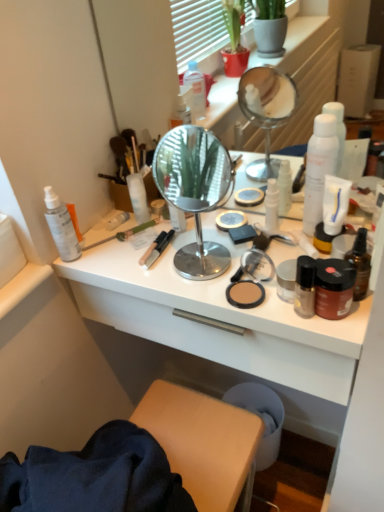
What is the approximate width of white matte spray can at right, the second bottle from the front?

white matte spray can at right, the second bottle from the front, is 5.17 centimeters in width.

The height and width of the screenshot is (512, 384). Describe the element at coordinates (61, 226) in the screenshot. I see `translucent plastic spray bottle at left, which is the eighth toiletry in right-to-left order` at that location.

You are a GUI agent. You are given a task and a screenshot of the screen. Output one action in this format:
    pyautogui.click(x=<x>, y=<y>)
    Task: Click on the brown matte jar at right, which is the seventh toiletry from left to right
    This screenshot has width=384, height=512.
    Given the screenshot: What is the action you would take?
    pyautogui.click(x=334, y=288)

The image size is (384, 512). Describe the element at coordinates (257, 348) in the screenshot. I see `white glossy desk at center` at that location.

Where is `white glossy bottle at center, the 5th toiletry viewed from the left`? Image resolution: width=384 pixels, height=512 pixels. white glossy bottle at center, the 5th toiletry viewed from the left is located at coordinates (272, 205).

Looking at this image, from a real-world perspective, is white glossy bottle at center, which is the 4th toiletry in right-to-left order, on translucent plastic spray bottle at left, which is the eighth toiletry in right-to-left order?

Incorrect, from a real-world perspective, white glossy bottle at center, which is the 4th toiletry in right-to-left order, is lower than translucent plastic spray bottle at left, which is the eighth toiletry in right-to-left order.

Is white glossy bottle at center, which is the 4th toiletry in right-to-left order, to the right of translucent plastic spray bottle at left, the 1th toiletry when ordered from left to right, from the viewer's perspective?

Yes, white glossy bottle at center, which is the 4th toiletry in right-to-left order, is to the right of translucent plastic spray bottle at left, the 1th toiletry when ordered from left to right.

Is translucent plastic spray bottle at left, the 1th toiletry when ordered from left to right, inside white glossy bottle at center, the 5th toiletry viewed from the left?

No, white glossy bottle at center, the 5th toiletry viewed from the left, does not contain translucent plastic spray bottle at left, the 1th toiletry when ordered from left to right.

Based on their sizes in the image, would you say white glossy bottle at center, which is the 4th toiletry in right-to-left order, is bigger or smaller than translucent plastic spray bottle at left, the 1th toiletry when ordered from left to right?

Considering their sizes, white glossy bottle at center, which is the 4th toiletry in right-to-left order, takes up less space than translucent plastic spray bottle at left, the 1th toiletry when ordered from left to right.

Can you tell me how much brown glass bottle at right, marked as the 1th bottle in a front-to-back arrangement, and matte gold jar at center right, which ranks as the eighth toiletry in left-to-right order, differ in facing direction?

0.00286 degrees.

Could you tell me if brown glass bottle at right, which is counted as the second bottle, starting from the back, is facing matte gold jar at center right, the 1th toiletry positioned from the right?

No, brown glass bottle at right, which is counted as the second bottle, starting from the back, is not oriented towards matte gold jar at center right, the 1th toiletry positioned from the right.

Considering the relative sizes of brown glass bottle at right, which is counted as the second bottle, starting from the back, and matte gold jar at center right, which ranks as the eighth toiletry in left-to-right order, in the image provided, is brown glass bottle at right, which is counted as the second bottle, starting from the back, shorter than matte gold jar at center right, which ranks as the eighth toiletry in left-to-right order,?

In fact, brown glass bottle at right, which is counted as the second bottle, starting from the back, may be taller than matte gold jar at center right, which ranks as the eighth toiletry in left-to-right order.

Does point (363, 282) appear closer or farther from the camera than point (320, 228)?

Point (363, 282) is closer to the camera than point (320, 228).

Is point (318, 222) behind point (364, 241)?

Yes, point (318, 222) is behind point (364, 241).

From a real-world perspective, which is physically below, white matte spray can at right, which is the first bottle from back to front, or brown glass bottle at right, positioned as the 2th bottle in top-to-bottom order?

In real-world perspective, brown glass bottle at right, positioned as the 2th bottle in top-to-bottom order, is lower.

In the scene shown: Considering the positions of objects white matte spray can at right, the second bottle from the front, and brown glass bottle at right, positioned as the 2th bottle in top-to-bottom order, in the image provided, who is more to the right, white matte spray can at right, the second bottle from the front, or brown glass bottle at right, positioned as the 2th bottle in top-to-bottom order,?

brown glass bottle at right, positioned as the 2th bottle in top-to-bottom order, is more to the right.

How different are the orientations of white matte spray can at right, which is the first bottle from back to front, and brown glass bottle at right, marked as the 1th bottle in a front-to-back arrangement, in degrees?

They differ by 0.00343 degrees in their facing directions.

Is white matte spray can at right, the second bottle from the front, oriented away from brown matte jar at right, the second toiletry viewed from the right?

No, white matte spray can at right, the second bottle from the front, is not facing the opposite direction of brown matte jar at right, the second toiletry viewed from the right.

Considering the sizes of white matte spray can at right, which is the 2th bottle from bottom to top, and brown matte jar at right, which is the seventh toiletry from left to right, in the image, is white matte spray can at right, which is the 2th bottle from bottom to top, taller or shorter than brown matte jar at right, which is the seventh toiletry from left to right,?

In the image, white matte spray can at right, which is the 2th bottle from bottom to top, appears to be taller than brown matte jar at right, which is the seventh toiletry from left to right.

From the image's perspective, which is below, white matte spray can at right, which is the first bottle from back to front, or brown matte jar at right, which is the seventh toiletry from left to right?

brown matte jar at right, which is the seventh toiletry from left to right.

In the image, is white matte spray can at right, the second bottle from the front, positioned in front of or behind brown matte jar at right, which is the seventh toiletry from left to right?

white matte spray can at right, the second bottle from the front, is behind brown matte jar at right, which is the seventh toiletry from left to right.

Considering the sizes of objects brown matte jar at right, which is the seventh toiletry from left to right, and satin black nail polish at right, which appears as the sixth toiletry when viewed from the left, in the image provided, who is smaller, brown matte jar at right, which is the seventh toiletry from left to right, or satin black nail polish at right, which appears as the sixth toiletry when viewed from the left,?

Smaller between the two is satin black nail polish at right, which appears as the sixth toiletry when viewed from the left.

Which object is closer to the camera taking this photo, brown matte jar at right, which is the seventh toiletry from left to right, or satin black nail polish at right, the third toiletry when ordered from right to left?

Positioned in front is satin black nail polish at right, the third toiletry when ordered from right to left.

Looking at the image, does white glossy desk at center seem bigger or smaller compared to matte gold jar at center right, the 1th toiletry positioned from the right?

In the image, white glossy desk at center appears to be larger than matte gold jar at center right, the 1th toiletry positioned from the right.

Is white glossy desk at center turned away from matte gold jar at center right, the 1th toiletry positioned from the right?

No.

Which is more to the right, white glossy desk at center or matte gold jar at center right, the 1th toiletry positioned from the right?

Positioned to the right is matte gold jar at center right, the 1th toiletry positioned from the right.

Who is shorter, white glossy desk at center or matte gold jar at center right, the 1th toiletry positioned from the right?

matte gold jar at center right, the 1th toiletry positioned from the right.

Considering the relative sizes of white matte bottle at center, the 5th toiletry viewed from the right, and matte gold jar at center right, which ranks as the eighth toiletry in left-to-right order, in the image provided, is white matte bottle at center, the 5th toiletry viewed from the right, thinner than matte gold jar at center right, which ranks as the eighth toiletry in left-to-right order,?

Yes, white matte bottle at center, the 5th toiletry viewed from the right, is thinner than matte gold jar at center right, which ranks as the eighth toiletry in left-to-right order.

Could you tell me if white matte bottle at center, the 5th toiletry viewed from the right, is turned towards matte gold jar at center right, which ranks as the eighth toiletry in left-to-right order?

No, white matte bottle at center, the 5th toiletry viewed from the right, is not oriented towards matte gold jar at center right, which ranks as the eighth toiletry in left-to-right order.

Locate an element on the screen. Image resolution: width=384 pixels, height=512 pixels. the 5th toiletry above the matte gold jar at center right, the 1th toiletry positioned from the right (from the image's perspective) is located at coordinates (138, 197).

Is matte gold jar at center right, which ranks as the eighth toiletry in left-to-right order, surrounded by white matte bottle at center, the 5th toiletry viewed from the right?

No, matte gold jar at center right, which ranks as the eighth toiletry in left-to-right order, is located outside of white matte bottle at center, the 5th toiletry viewed from the right.

Locate an element on the screen. The image size is (384, 512). toiletry that is the 4th one when counting leftward from the white glossy bottle at center, the 5th toiletry viewed from the left is located at coordinates (61, 226).

Locate an element on the screen. The image size is (384, 512). the 6th toiletry directly beneath the brown glass bottle at right, which ranks as the first bottle in bottom-to-top order (from a real-world perspective) is located at coordinates (322, 239).

Looking at the image, which one is located closer to matte gold jar at center right, the 1th toiletry positioned from the right, satin black nail polish at right, the third toiletry when ordered from right to left, or brown matte jar at right, which is the seventh toiletry from left to right?

Among the two, satin black nail polish at right, the third toiletry when ordered from right to left, is located nearer to matte gold jar at center right, the 1th toiletry positioned from the right.

Considering their positions, is brown glass bottle at right, marked as the 1th bottle in a front-to-back arrangement, positioned closer to brown matte jar at right, the second toiletry viewed from the right, than white matte spray can at right, the second bottle from the front?

Based on the image, brown glass bottle at right, marked as the 1th bottle in a front-to-back arrangement, appears to be nearer to brown matte jar at right, the second toiletry viewed from the right.

Based on their spatial positions, is brown glass bottle at right, marked as the 1th bottle in a front-to-back arrangement, or matte gold jar at center right, which ranks as the eighth toiletry in left-to-right order, closer to clear plastic tube at center, marked as the sixth toiletry in a right-to-left arrangement?

matte gold jar at center right, which ranks as the eighth toiletry in left-to-right order, is positioned closer to the anchor clear plastic tube at center, marked as the sixth toiletry in a right-to-left arrangement.

Which object lies further to the anchor point white glossy bottle at center, the 5th toiletry viewed from the left, white matte spray can at left, marked as the second toiletry in a left-to-right arrangement, or brown matte jar at right, the second toiletry viewed from the right?

white matte spray can at left, marked as the second toiletry in a left-to-right arrangement, lies further to white glossy bottle at center, the 5th toiletry viewed from the left, than the other object.

Looking at the image, which one is located closer to polished chrome mirror at center, clear plastic tube at center, the third toiletry in the left-to-right sequence, or translucent plastic spray bottle at left, which is the eighth toiletry in right-to-left order?

Based on the image, clear plastic tube at center, the third toiletry in the left-to-right sequence, appears to be nearer to polished chrome mirror at center.

Looking at the image, which one is located further to brown glass bottle at right, which ranks as the first bottle in bottom-to-top order, white matte bottle at center, the 5th toiletry viewed from the right, or matte gold jar at center right, the 1th toiletry positioned from the right?

white matte bottle at center, the 5th toiletry viewed from the right, is further to brown glass bottle at right, which ranks as the first bottle in bottom-to-top order.

Estimate the real-world distances between objects in this image. Which object is further from white glossy desk at center, matte gold jar at center right, the 1th toiletry positioned from the right, or white matte bottle at center, the 4th toiletry positioned from the left?

The object further to white glossy desk at center is white matte bottle at center, the 4th toiletry positioned from the left.

Estimate the real-world distances between objects in this image. Which object is closer to white glossy desk at center, polished chrome mirror at center or brown glass bottle at right, which ranks as the first bottle in bottom-to-top order?

brown glass bottle at right, which ranks as the first bottle in bottom-to-top order, is positioned closer to the anchor white glossy desk at center.

Where is `desk between satin black nail polish at right, the third toiletry when ordered from right to left, and clear plastic tube at center, the third toiletry in the left-to-right sequence, in the front-back direction`? The width and height of the screenshot is (384, 512). desk between satin black nail polish at right, the third toiletry when ordered from right to left, and clear plastic tube at center, the third toiletry in the left-to-right sequence, in the front-back direction is located at coordinates (257, 348).

You are a GUI agent. You are given a task and a screenshot of the screen. Output one action in this format:
    pyautogui.click(x=<x>, y=<y>)
    Task: Click on the desk located between translucent plastic spray bottle at left, the 1th toiletry when ordered from left to right, and white glossy bottle at center, the 5th toiletry viewed from the left, in the left-right direction
    
    Given the screenshot: What is the action you would take?
    pyautogui.click(x=257, y=348)

Locate an element on the screen. The image size is (384, 512). mirror between white matte bottle at center, the 4th toiletry positioned from the left, and matte gold jar at center right, the 1th toiletry positioned from the right, from left to right is located at coordinates (195, 192).

Image resolution: width=384 pixels, height=512 pixels. I want to click on bottle located between white glossy desk at center and brown glass bottle at right, marked as the 1th bottle in a front-to-back arrangement, in the left-right direction, so click(x=319, y=168).